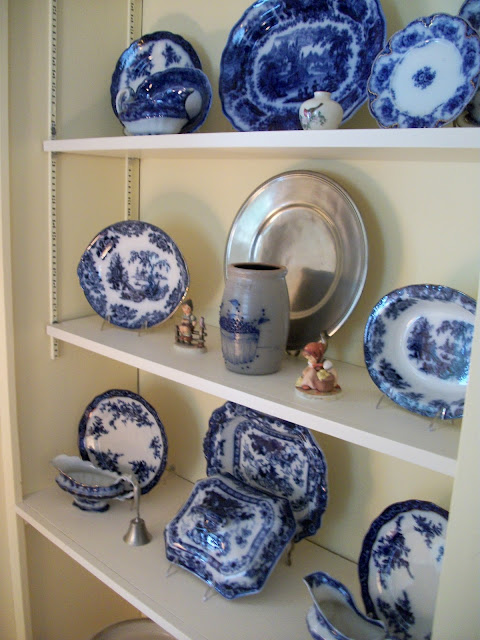
Where is `white plate with blue pattern`? The height and width of the screenshot is (640, 480). white plate with blue pattern is located at coordinates (413, 573), (132, 452), (418, 333), (131, 274).